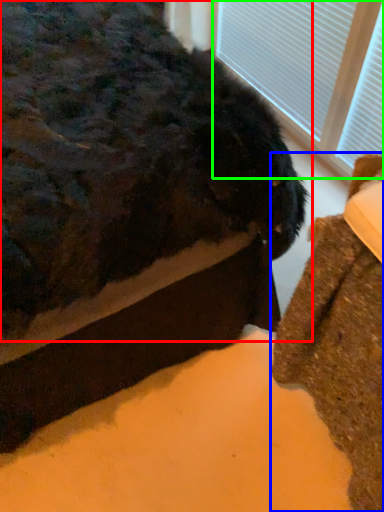
Question: Based on their relative distances, which object is farther from animal (highlighted by a red box)? Choose from furniture (highlighted by a blue box) and bay window (highlighted by a green box).

Choices:
 (A) furniture
 (B) bay window

Answer: (B)